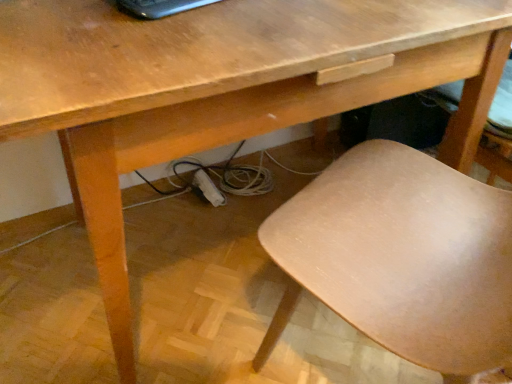
Describe the element at coordinates (159, 7) in the screenshot. I see `black glossy laptop at upper center` at that location.

This screenshot has height=384, width=512. Identify the location of black glossy laptop at upper center. (159, 7).

I want to click on light brown wood chair at lower right, so click(401, 257).

What do you see at coordinates (401, 257) in the screenshot? The height and width of the screenshot is (384, 512). I see `light brown wood chair at lower right` at bounding box center [401, 257].

From the picture: What is the approximate width of light brown wood chair at lower right?

20.22 inches.

Image resolution: width=512 pixels, height=384 pixels. Find the location of `black glossy laptop at upper center`. black glossy laptop at upper center is located at coordinates (159, 7).

Looking at this image, which is more to the left, black glossy laptop at upper center or light brown wood chair at lower right?

black glossy laptop at upper center is more to the left.

Is black glossy laptop at upper center in front of light brown wood chair at lower right?

No, black glossy laptop at upper center is further to the viewer.

Does point (123, 3) come closer to viewer compared to point (352, 288)?

No, it is not.

From the image's perspective, relative to light brown wood chair at lower right, is black glossy laptop at upper center above or below?

Based on their image positions, black glossy laptop at upper center is located above light brown wood chair at lower right.

From a real-world perspective, is black glossy laptop at upper center located beneath light brown wood chair at lower right?

No, from a real-world perspective, black glossy laptop at upper center is not under light brown wood chair at lower right.

Which of these two, black glossy laptop at upper center or light brown wood chair at lower right, is thinner?

black glossy laptop at upper center is thinner.

Considering the relative sizes of black glossy laptop at upper center and light brown wood chair at lower right in the image provided, is black glossy laptop at upper center shorter than light brown wood chair at lower right?

Yes.

Considering the sizes of black glossy laptop at upper center and light brown wood chair at lower right in the image, is black glossy laptop at upper center bigger or smaller than light brown wood chair at lower right?

Clearly, black glossy laptop at upper center is smaller in size than light brown wood chair at lower right.

Can we say black glossy laptop at upper center lies outside light brown wood chair at lower right?

Yes, black glossy laptop at upper center is outside of light brown wood chair at lower right.

Would you say black glossy laptop at upper center is a long distance from light brown wood chair at lower right?

A: black glossy laptop at upper center is actually quite close to light brown wood chair at lower right.

Is black glossy laptop at upper center oriented away from light brown wood chair at lower right?

That's not correct — black glossy laptop at upper center is not looking away from light brown wood chair at lower right.

How many degrees apart are the facing directions of black glossy laptop at upper center and light brown wood chair at lower right?

The facing directions of black glossy laptop at upper center and light brown wood chair at lower right are 177 degrees apart.

This screenshot has height=384, width=512. Find the location of `chair on the right of black glossy laptop at upper center`. chair on the right of black glossy laptop at upper center is located at coordinates (401, 257).

Which is more to the right, light brown wood chair at lower right or black glossy laptop at upper center?

light brown wood chair at lower right is more to the right.

Relative to black glossy laptop at upper center, is light brown wood chair at lower right in front or behind?

light brown wood chair at lower right is in front of black glossy laptop at upper center.

Which is less distant, (470, 222) or (202, 2)?

Clearly, point (470, 222) is more distant from the camera than point (202, 2).

From the image's perspective, which one is positioned higher, light brown wood chair at lower right or black glossy laptop at upper center?

black glossy laptop at upper center appears higher in the image.

From a real-world perspective, does light brown wood chair at lower right sit lower than black glossy laptop at upper center?

Indeed, from a real-world perspective, light brown wood chair at lower right is positioned beneath black glossy laptop at upper center.

Which object is thinner, light brown wood chair at lower right or black glossy laptop at upper center?

With smaller width is black glossy laptop at upper center.

Which of these two, light brown wood chair at lower right or black glossy laptop at upper center, stands shorter?

With less height is black glossy laptop at upper center.

Who is bigger, light brown wood chair at lower right or black glossy laptop at upper center?

light brown wood chair at lower right.

Do you think light brown wood chair at lower right is within black glossy laptop at upper center, or outside of it?

light brown wood chair at lower right is spatially situated outside black glossy laptop at upper center.

Are light brown wood chair at lower right and black glossy laptop at upper center located far from each other?

light brown wood chair at lower right is near black glossy laptop at upper center, not far away.

Could you tell me if light brown wood chair at lower right is turned towards black glossy laptop at upper center?

Yes.

The height and width of the screenshot is (384, 512). What are the coordinates of `chair in front of the black glossy laptop at upper center` in the screenshot? It's located at (401, 257).

What are the coordinates of `laptop that is above the light brown wood chair at lower right (from the image's perspective)` in the screenshot? It's located at (159, 7).

There is a light brown wood chair at lower right. Find the location of `laptop above it (from a real-world perspective)`. laptop above it (from a real-world perspective) is located at coordinates (159, 7).